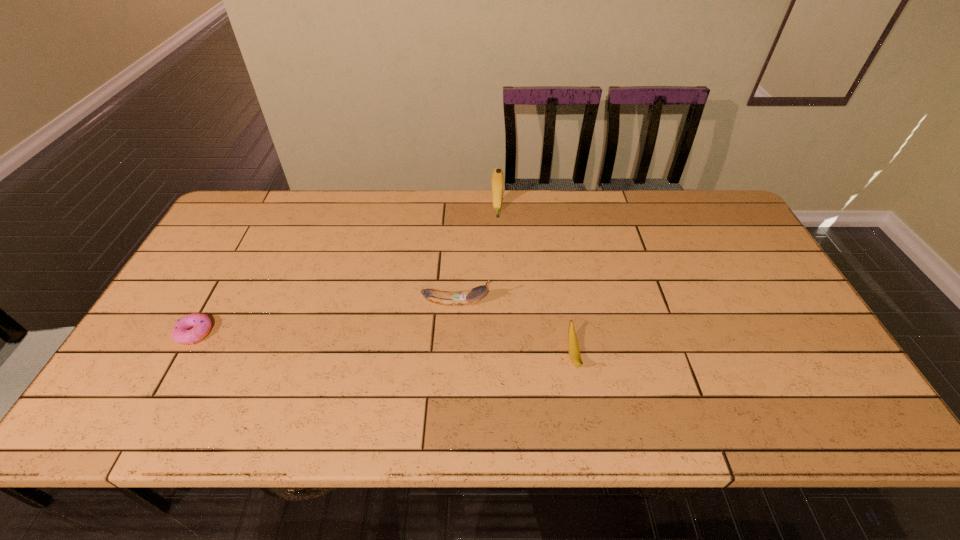
What are the coordinates of `the tallest object` in the screenshot? It's located at (497, 180).

Where is `the second banana from left to right`? Image resolution: width=960 pixels, height=540 pixels. the second banana from left to right is located at coordinates (497, 180).

Image resolution: width=960 pixels, height=540 pixels. Identify the location of the second farthest banana. (473, 295).

You are a GUI agent. You are given a task and a screenshot of the screen. Output one action in this format:
    pyautogui.click(x=<x>, y=<y>)
    Task: Click on the third shortest object
    The width and height of the screenshot is (960, 540).
    Given the screenshot: What is the action you would take?
    pyautogui.click(x=473, y=295)

The height and width of the screenshot is (540, 960). Find the location of `the nearest banana`. the nearest banana is located at coordinates (573, 347).

The image size is (960, 540). What are the coordinates of `the shortest banana` in the screenshot? It's located at (573, 347).

Find the location of a particular element. the shortest object is located at coordinates (182, 333).

This screenshot has height=540, width=960. Find the location of `the leftmost object`. the leftmost object is located at coordinates (182, 333).

Locate an element on the screen. This screenshot has height=540, width=960. blank area located from the stem of the third object from left to right is located at coordinates (499, 266).

Find the location of a particular element. The width and height of the screenshot is (960, 540). free spot located on the peel of the third shortest object is located at coordinates point(508,303).